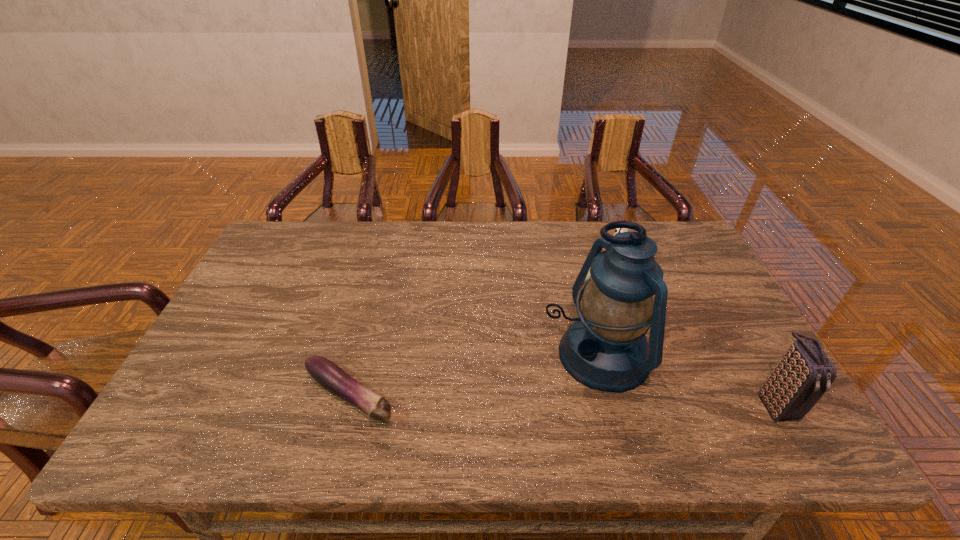
Locate an element on the screen. The width and height of the screenshot is (960, 540). vacant region located 0.140m on the face of the tallest object is located at coordinates (505, 399).

At what (x,y) coordinates should I click in order to perform the action: click on free space located on the face of the tallest object. Please return your answer as a coordinate pair (x, y). Looking at the image, I should click on (509, 397).

Where is `object that is at the far edge`? object that is at the far edge is located at coordinates (619, 230).

This screenshot has height=540, width=960. What are the coordinates of `eggplant at the near edge` in the screenshot? It's located at (327, 374).

The height and width of the screenshot is (540, 960). I want to click on clutch bag present at the near edge, so click(802, 376).

Where is `lantern that is at the near edge`? The width and height of the screenshot is (960, 540). lantern that is at the near edge is located at coordinates (606, 349).

The image size is (960, 540). What are the coordinates of `object that is positioned at the right edge` in the screenshot? It's located at (802, 376).

This screenshot has width=960, height=540. In order to click on object that is at the near right corner in this screenshot , I will do `click(802, 376)`.

This screenshot has width=960, height=540. I want to click on vacant space at the far edge of the desktop, so point(470,235).

The height and width of the screenshot is (540, 960). In order to click on free location at the near edge of the desktop in this screenshot , I will do `click(299, 413)`.